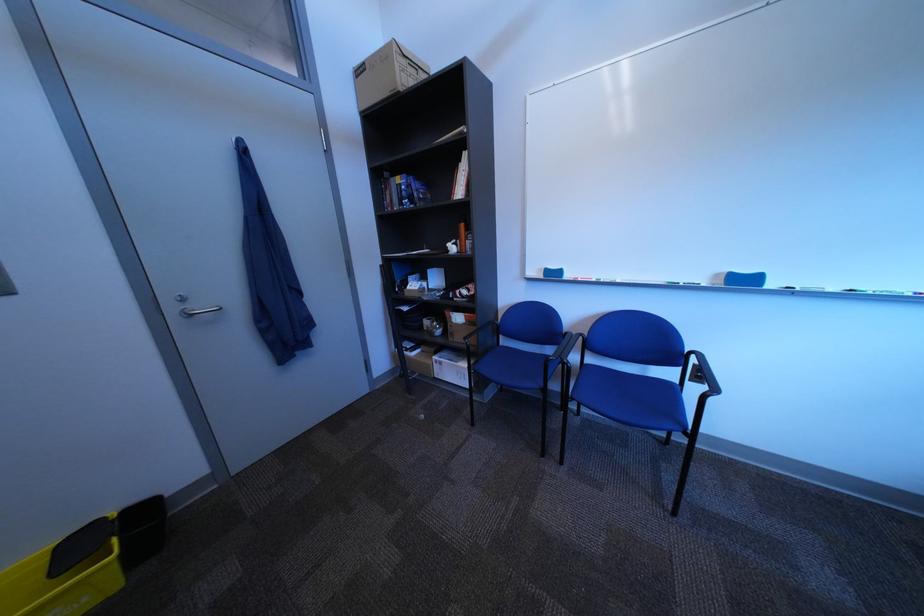
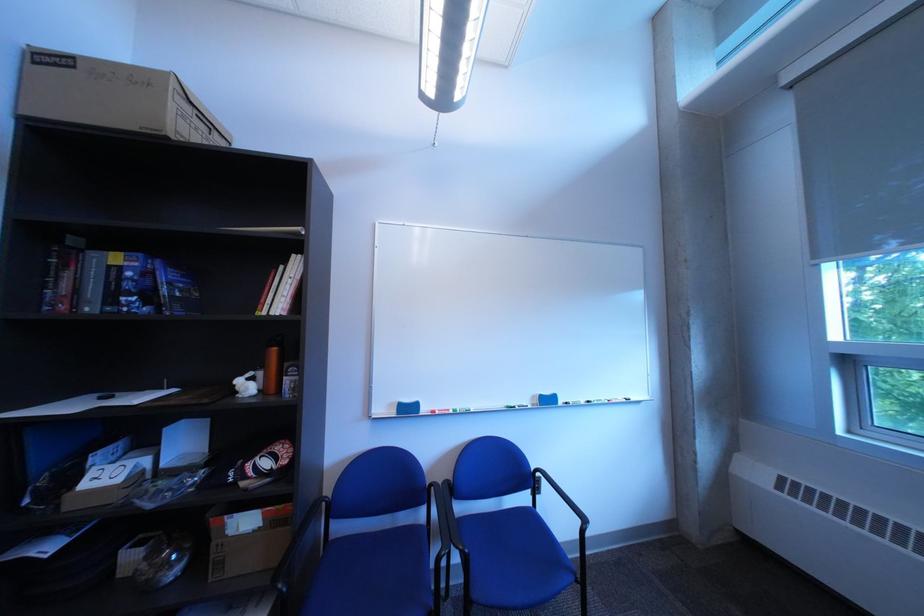
Find the pixel in the second image that matches pixel 714 374 in the first image.

(552, 485)